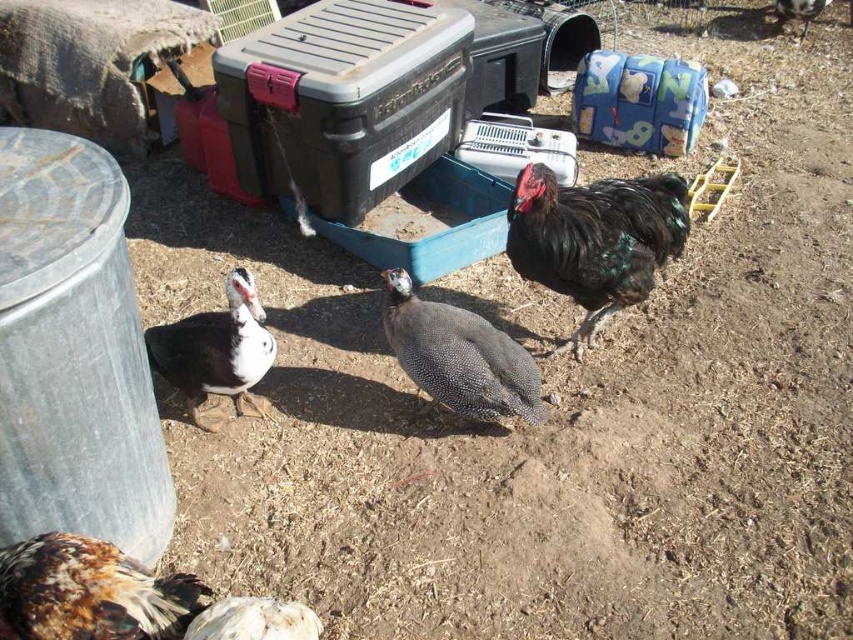
You are a farmer checking on your poultry. You notice the speckled feathered chicken at lower left and the dark brown feathers at center. Which bird is closer to the ground?

The speckled feathered chicken at lower left is closer to the ground because it is positioned under the dark brown feathers at center.

You are standing in the rural outdoor setting depicted in the image. There are two points marked in the scene, point A at coordinates point (25, 614) and point B at coordinates point (169, 339). If you were to walk towards both points from your current position, which point would you reach first?

Point A at coordinates point (25, 614) is closer to the camera than point B at coordinates point (169, 339), so you would reach point A first.

You are a farmer checking on your poultry. You see the speckled feathered chicken at lower left and the speckled feathered guinea fowl at center. Which bird is closer to you?

The speckled feathered chicken at lower left is closer to you because it is in front of the speckled feathered guinea fowl at center.